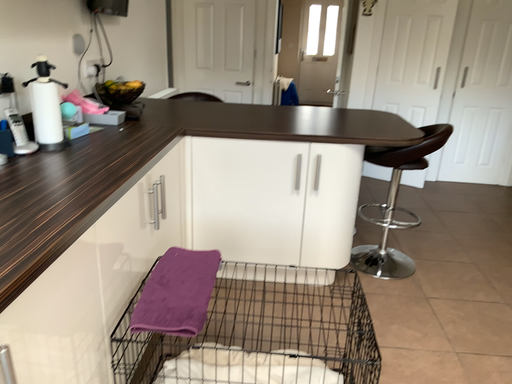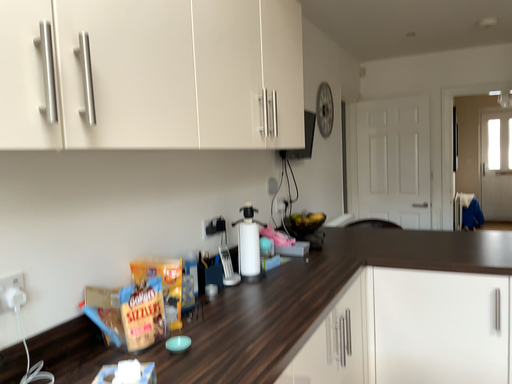
Question: How did the camera likely rotate when shooting the video?

Choices:
 (A) rotated upward
 (B) rotated downward

Answer: (A)